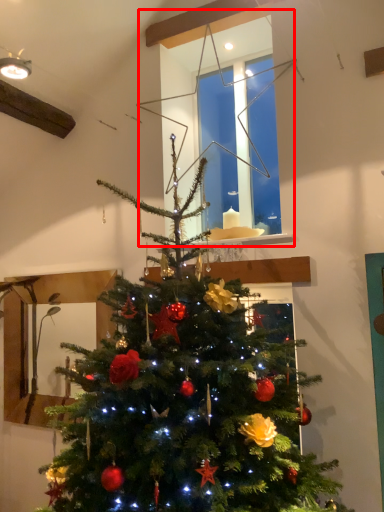
Question: From the image's perspective, where is window (annotated by the red box) located relative to christmas tree?

Choices:
 (A) below
 (B) above

Answer: (B)